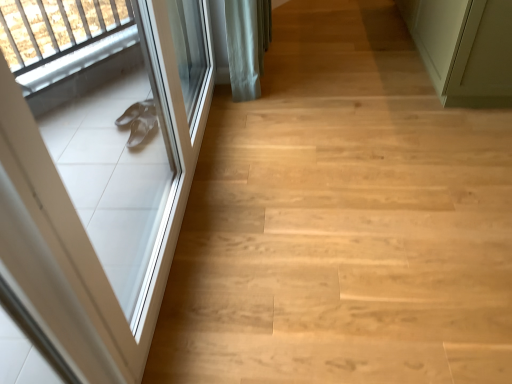
At what (x,y) coordinates should I click in order to perform the action: click on light wood floor at left. Please return your answer as a coordinate pair (x, y). This screenshot has height=384, width=512. Looking at the image, I should click on (343, 221).

Is white glossy door at left, which ranks as the 2th door in right-to-left order, inside green matte door at upper right, which is the second door from left to right?

No, green matte door at upper right, which is the second door from left to right, does not contain white glossy door at left, which ranks as the 2th door in right-to-left order.

How far apart are green matte door at upper right, which is the second door from left to right, and white glossy door at left, marked as the 1th door in a left-to-right arrangement?

A distance of 5.62 feet exists between green matte door at upper right, which is the second door from left to right, and white glossy door at left, marked as the 1th door in a left-to-right arrangement.

Does green matte door at upper right, the 1th door when ordered from right to left, have a greater height compared to white glossy door at left, marked as the 1th door in a left-to-right arrangement?

In fact, green matte door at upper right, the 1th door when ordered from right to left, may be shorter than white glossy door at left, marked as the 1th door in a left-to-right arrangement.

From a real-world perspective, is green matte door at upper right, which is the second door from left to right, on top of white glossy door at left, marked as the 1th door in a left-to-right arrangement?

No.

Does point (194, 104) come in front of point (319, 322)?

No, (194, 104) is behind (319, 322).

From a real-world perspective, relative to light wood floor at left, is white glossy door at left, which ranks as the 2th door in right-to-left order, vertically above or below?

In terms of real-world spatial position, white glossy door at left, which ranks as the 2th door in right-to-left order, is above light wood floor at left.

How many degrees apart are the facing directions of white glossy door at left, which ranks as the 2th door in right-to-left order, and light wood floor at left?

white glossy door at left, which ranks as the 2th door in right-to-left order, and light wood floor at left are facing 90 degrees away from each other.

From the image's perspective, is white glossy door at left, which ranks as the 2th door in right-to-left order, on light wood floor at left?

No.

Could you tell me if white glossy door at left, which ranks as the 2th door in right-to-left order, is turned towards green matte door at upper right, the 1th door when ordered from right to left?

Yes, white glossy door at left, which ranks as the 2th door in right-to-left order, is oriented towards green matte door at upper right, the 1th door when ordered from right to left.

Is white glossy door at left, marked as the 1th door in a left-to-right arrangement, at the left side of green matte door at upper right, the 1th door when ordered from right to left?

Yes.

From the image's perspective, is white glossy door at left, marked as the 1th door in a left-to-right arrangement, over green matte door at upper right, which is the second door from left to right?

Actually, white glossy door at left, marked as the 1th door in a left-to-right arrangement, appears below green matte door at upper right, which is the second door from left to right, in the image.

Is white glossy door at left, which ranks as the 2th door in right-to-left order, smaller than green matte door at upper right, the 1th door when ordered from right to left?

Yes, white glossy door at left, which ranks as the 2th door in right-to-left order, is smaller than green matte door at upper right, the 1th door when ordered from right to left.

Can you tell me how much light wood floor at left and white glossy door at left, which ranks as the 2th door in right-to-left order, differ in facing direction?

The angular difference between light wood floor at left and white glossy door at left, which ranks as the 2th door in right-to-left order, is 90 degrees.

Is light wood floor at left positioned with its back to white glossy door at left, marked as the 1th door in a left-to-right arrangement?

No, light wood floor at left is not facing the opposite direction of white glossy door at left, marked as the 1th door in a left-to-right arrangement.

Is light wood floor at left at the left side of white glossy door at left, which ranks as the 2th door in right-to-left order?

Incorrect, light wood floor at left is not on the left side of white glossy door at left, which ranks as the 2th door in right-to-left order.

From a real-world perspective, is light wood floor at left beneath white glossy door at left, which ranks as the 2th door in right-to-left order?

Yes, from a real-world perspective, light wood floor at left is beneath white glossy door at left, which ranks as the 2th door in right-to-left order.

From a real-world perspective, is green matte door at upper right, which is the second door from left to right, on light wood floor at left?

Correct, in the physical world, green matte door at upper right, which is the second door from left to right, is higher than light wood floor at left.

What are the coordinates of `stairwell directly beneath the green matte door at upper right, which is the second door from left to right (from a real-world perspective)` in the screenshot? It's located at (343, 221).

Is green matte door at upper right, the 1th door when ordered from right to left, bigger than light wood floor at left?

Correct, green matte door at upper right, the 1th door when ordered from right to left, is larger in size than light wood floor at left.

Locate an element on the screen. The width and height of the screenshot is (512, 384). door above the light wood floor at left (from the image's perspective) is located at coordinates (436, 35).

Considering the sizes of objects light wood floor at left and green matte door at upper right, which is the second door from left to right, in the image provided, who is smaller, light wood floor at left or green matte door at upper right, which is the second door from left to right,?

light wood floor at left.

Which is nearer, (336, 134) or (461, 0)?

Point (336, 134) is positioned farther from the camera compared to point (461, 0).

You are a GUI agent. You are given a task and a screenshot of the screen. Output one action in this format:
    pyautogui.click(x=<x>, y=<y>)
    Task: Click on the door below the green matte door at upper right, the 1th door when ordered from right to left (from the image's perspective)
    
    Given the screenshot: What is the action you would take?
    pyautogui.click(x=97, y=171)

This screenshot has width=512, height=384. I want to click on door on the left of light wood floor at left, so click(97, 171).

From the image, which object appears to be nearer to green matte door at upper right, which is the second door from left to right, light wood floor at left or white glossy door at left, which ranks as the 2th door in right-to-left order?

Based on the image, light wood floor at left appears to be nearer to green matte door at upper right, which is the second door from left to right.

From the image, which object appears to be farther from white glossy door at left, marked as the 1th door in a left-to-right arrangement, light wood floor at left or green matte door at upper right, which is the second door from left to right?

green matte door at upper right, which is the second door from left to right, is further to white glossy door at left, marked as the 1th door in a left-to-right arrangement.

From the picture: When comparing their distances from light wood floor at left, does green matte door at upper right, which is the second door from left to right, or white glossy door at left, which ranks as the 2th door in right-to-left order, seem closer?

white glossy door at left, which ranks as the 2th door in right-to-left order, is closer to light wood floor at left.

Consider the image. Estimate the real-world distances between objects in this image. Which object is further from light wood floor at left, white glossy door at left, which ranks as the 2th door in right-to-left order, or green matte door at upper right, the 1th door when ordered from right to left?

green matte door at upper right, the 1th door when ordered from right to left.

Which object lies nearer to the anchor point green matte door at upper right, which is the second door from left to right, white glossy door at left, which ranks as the 2th door in right-to-left order, or light wood floor at left?

light wood floor at left is closer to green matte door at upper right, which is the second door from left to right.

When comparing their distances from white glossy door at left, marked as the 1th door in a left-to-right arrangement, does green matte door at upper right, the 1th door when ordered from right to left, or light wood floor at left seem further?

The object further to white glossy door at left, marked as the 1th door in a left-to-right arrangement, is green matte door at upper right, the 1th door when ordered from right to left.

Identify the location of stairwell between white glossy door at left, marked as the 1th door in a left-to-right arrangement, and green matte door at upper right, the 1th door when ordered from right to left, from left to right. Image resolution: width=512 pixels, height=384 pixels. (343, 221).